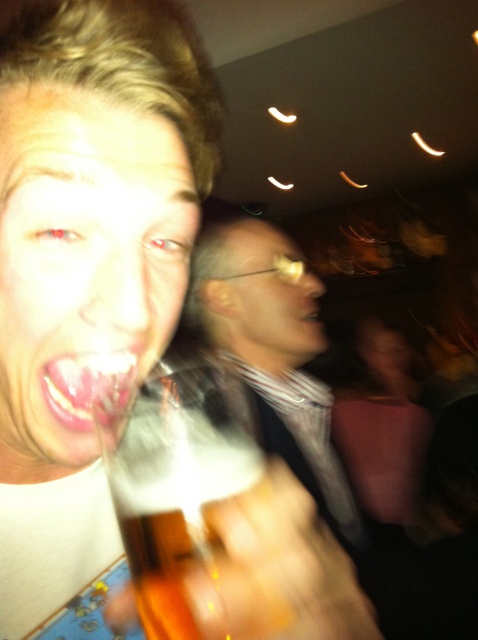
Does translucent amber glass at center have a larger size compared to glossy plastic mouth at center?

Correct, translucent amber glass at center is larger in size than glossy plastic mouth at center.

Is point (120, 422) positioned behind point (108, 371)?

Yes, point (120, 422) is behind point (108, 371).

What do you see at coordinates (171, 499) in the screenshot? The image size is (478, 640). I see `translucent amber glass at center` at bounding box center [171, 499].

You are a GUI agent. You are given a task and a screenshot of the screen. Output one action in this format:
    pyautogui.click(x=<x>, y=<y>)
    Task: Click on the translucent amber glass at center
    This screenshot has width=478, height=640.
    Given the screenshot: What is the action you would take?
    pyautogui.click(x=171, y=499)

Which is above, translucent amber glass at center or matte white teeth at center?

Positioned higher is matte white teeth at center.

Looking at this image, is translucent amber glass at center shorter than matte white teeth at center?

In fact, translucent amber glass at center may be taller than matte white teeth at center.

Between point (130, 413) and point (302, 308), which one is positioned in front?

Point (130, 413) is in front.

You are a GUI agent. You are given a task and a screenshot of the screen. Output one action in this format:
    pyautogui.click(x=<x>, y=<y>)
    Task: Click on the translucent amber glass at center
    
    Given the screenshot: What is the action you would take?
    pyautogui.click(x=171, y=499)

What do you see at coordinates (83, 264) in the screenshot? The image size is (478, 640). I see `matte skin face at center` at bounding box center [83, 264].

Is matte skin face at center above matte white teeth at center?

Incorrect, matte skin face at center is not positioned above matte white teeth at center.

Is point (58, 324) in front of point (304, 307)?

Yes.

The width and height of the screenshot is (478, 640). I want to click on matte skin face at center, so click(x=83, y=264).